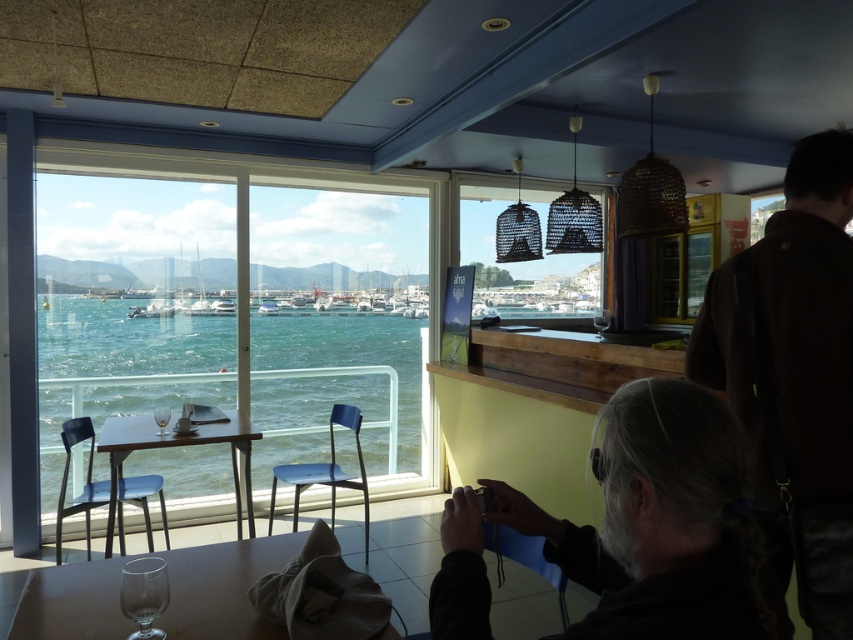
Question: Which object appears closest to the camera in this image?

Choices:
 (A) transparent glass at lower left
 (B) gray hair at center

Answer: (B)

Question: Does dark wood table at lower left appear over clear glass wine glass at lower left?

Choices:
 (A) no
 (B) yes

Answer: (A)

Question: Is dark brown leather jacket at upper right positioned at the back of dark wood table at lower left?

Choices:
 (A) no
 (B) yes

Answer: (A)

Question: Among these objects, which one is nearest to the camera?

Choices:
 (A) woven wood lanterns at center
 (B) dark wood table at lower left
 (C) clear glass wine glass at lower left

Answer: (B)

Question: Estimate the real-world distances between objects in this image. Which object is closer to the clear glass wine glass at lower left?

Choices:
 (A) gray hair at center
 (B) teal glossy water at lower left

Answer: (A)

Question: Is dark brown leather jacket at upper right smaller than transparent glass at right?

Choices:
 (A) yes
 (B) no

Answer: (B)